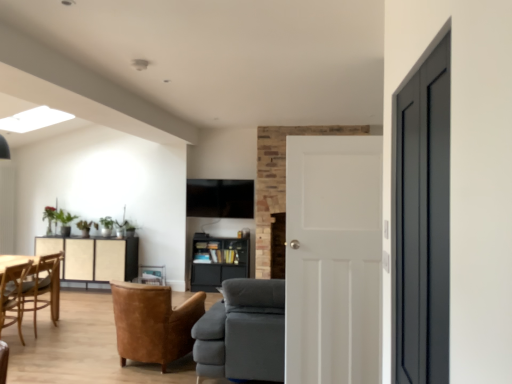
Question: Would you say matte black bookshelf at center is a long distance from gray fabric couch at center?

Choices:
 (A) no
 (B) yes

Answer: (B)

Question: Considering the relative sizes of matte black bookshelf at center and gray fabric couch at center in the image provided, is matte black bookshelf at center wider than gray fabric couch at center?

Choices:
 (A) no
 (B) yes

Answer: (A)

Question: From a real-world perspective, is matte black bookshelf at center on top of gray fabric couch at center?

Choices:
 (A) no
 (B) yes

Answer: (A)

Question: Could you tell me if matte black bookshelf at center is facing gray fabric couch at center?

Choices:
 (A) no
 (B) yes

Answer: (B)

Question: Is matte black bookshelf at center next to gray fabric couch at center?

Choices:
 (A) yes
 (B) no

Answer: (B)

Question: Is matte black bookshelf at center looking in the opposite direction of gray fabric couch at center?

Choices:
 (A) yes
 (B) no

Answer: (B)

Question: From a real-world perspective, is leather armchair at center, the first chair positioned from the right, physically below wooden chair at lower left, acting as the 1th chair starting from the left?

Choices:
 (A) no
 (B) yes

Answer: (B)

Question: Considering the relative sizes of leather armchair at center, the second chair in the back-to-front sequence, and wooden chair at lower left, which is the 1th chair in back-to-front order, in the image provided, is leather armchair at center, the second chair in the back-to-front sequence, taller than wooden chair at lower left, which is the 1th chair in back-to-front order,?

Choices:
 (A) yes
 (B) no

Answer: (B)

Question: From a real-world perspective, is leather armchair at center, placed as the second chair when sorted from left to right, physically above wooden chair at lower left, which is the 1th chair in back-to-front order?

Choices:
 (A) yes
 (B) no

Answer: (B)

Question: From the image's perspective, is leather armchair at center, the first chair positioned from the right, beneath wooden chair at lower left, arranged as the second chair when viewed from the right?

Choices:
 (A) yes
 (B) no

Answer: (A)

Question: Considering the relative positions of leather armchair at center, the first chair viewed from the front, and wooden chair at lower left, the 2th chair viewed from the front, in the image provided, is leather armchair at center, the first chair viewed from the front, to the right of wooden chair at lower left, the 2th chair viewed from the front, from the viewer's perspective?

Choices:
 (A) yes
 (B) no

Answer: (A)

Question: Is wooden chair at lower left, arranged as the second chair when viewed from the right, surrounded by leather armchair at center, placed as the second chair when sorted from left to right?

Choices:
 (A) yes
 (B) no

Answer: (B)

Question: Is wooden chair at lower left, which is the 1th chair in back-to-front order, shorter than matte black bookshelf at center?

Choices:
 (A) no
 (B) yes

Answer: (A)